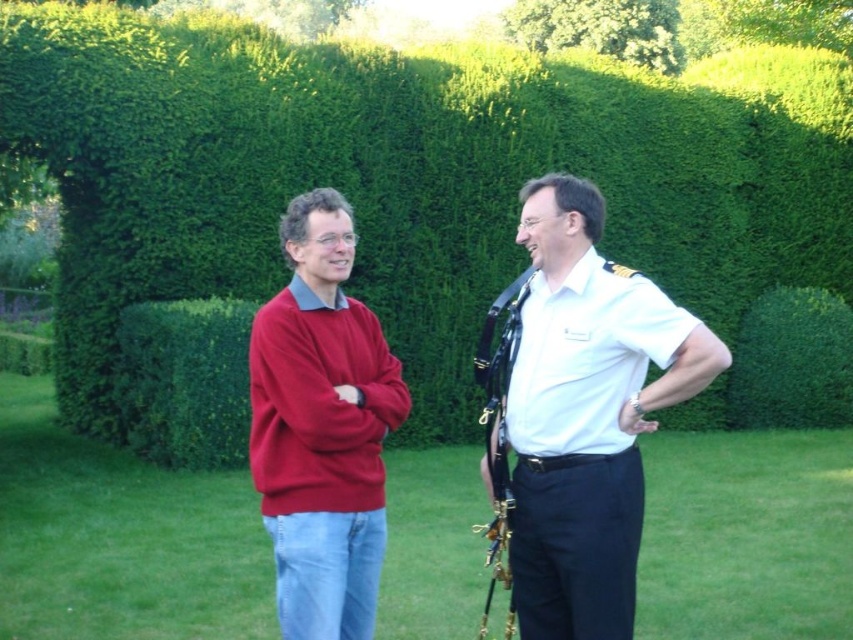
Looking at this image, you are a photographer planning to take a group photo of the two people in the scene. You want to ensure that both the green leafy hedge at upper center and the white uniform at center are visible in the frame. Based on their positions, which object is higher in the image?

The green leafy hedge at upper center is located above the white uniform at center, so it is higher in the image.

You are a photographer planning to take a picture of the green grass at center and the white smooth polo shirt at right. Based on their positions, which object is closer to the camera?

The white smooth polo shirt at right is closer to the camera because the green grass at center is located below it, indicating it is positioned further back in the scene.

You are a photographer trying to capture a photo of the white uniform at center while ensuring the green leafy hedge at upper center is visible in the background. Based on their sizes, do you think the hedge will appear larger than the uniform in the photo?

The green leafy hedge at upper center might be wider than the white uniform at center, so it is possible that the hedge will appear larger in the photo.